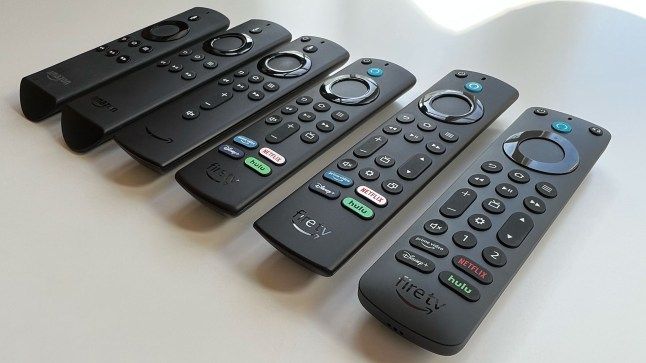
Where is `remote control`? The width and height of the screenshot is (646, 363). remote control is located at coordinates pyautogui.click(x=86, y=72), pyautogui.click(x=120, y=92), pyautogui.click(x=174, y=125), pyautogui.click(x=224, y=167), pyautogui.click(x=317, y=216), pyautogui.click(x=424, y=281).